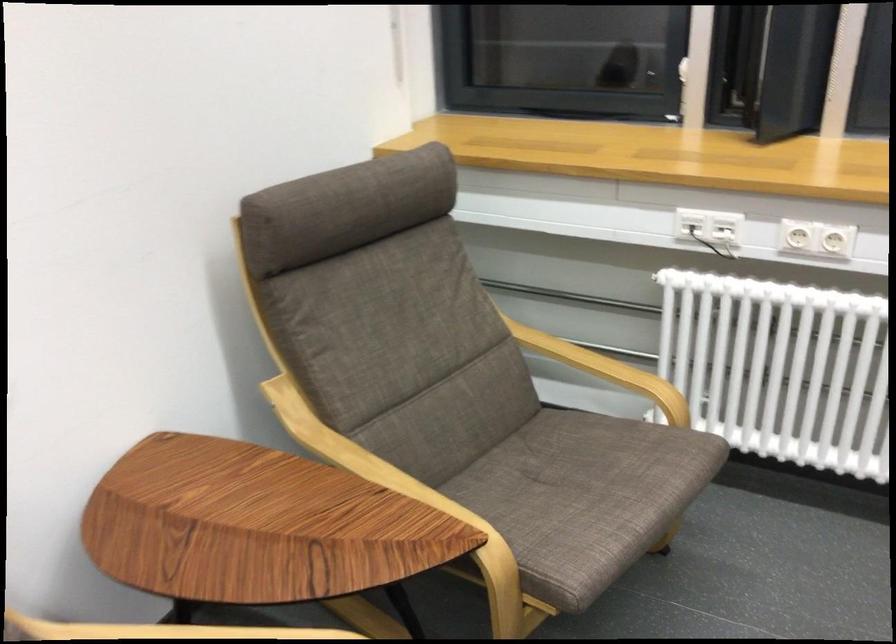
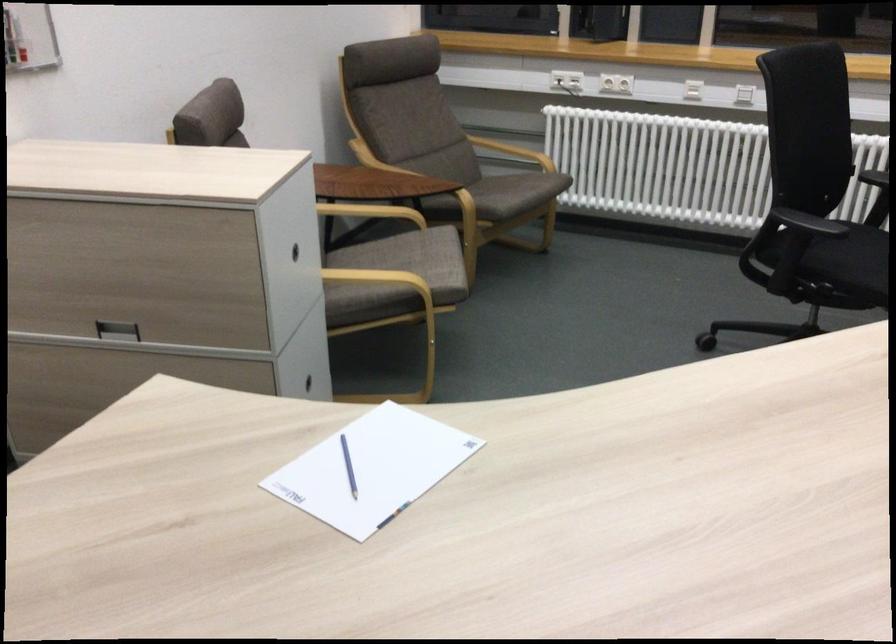
Where in the second image is the point corresponding to [575,509] from the first image?

(510, 191)